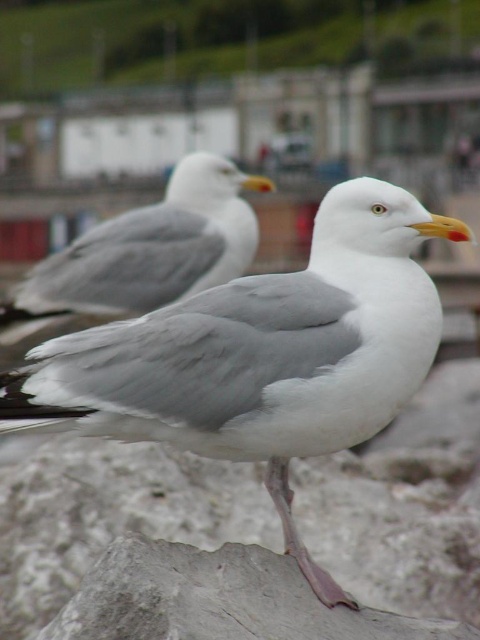
Question: Among these objects, which one is nearest to the camera?

Choices:
 (A) white feathered seagull at center
 (B) white feathered bird at center

Answer: (B)

Question: Does white feathered bird at center appear over white feathered seagull at center?

Choices:
 (A) no
 (B) yes

Answer: (A)

Question: Which object appears closest to the camera in this image?

Choices:
 (A) white feathered seagull at center
 (B) white feathered bird at center

Answer: (B)

Question: Which point is farther to the camera?

Choices:
 (A) (247, 180)
 (B) (39, 378)

Answer: (A)

Question: Does white feathered bird at center have a greater width compared to white feathered seagull at center?

Choices:
 (A) yes
 (B) no

Answer: (B)

Question: Is white feathered bird at center to the left of white feathered seagull at center from the viewer's perspective?

Choices:
 (A) no
 (B) yes

Answer: (A)